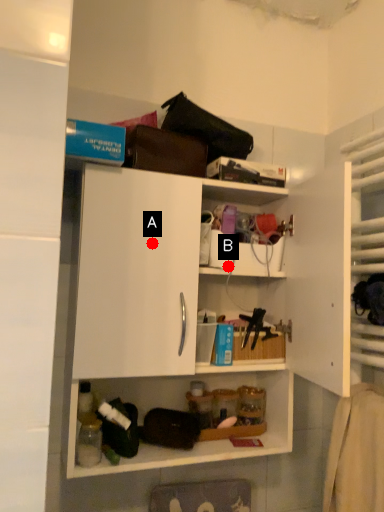
Question: Two points are circled on the image, labeled by A and B beside each circle. Among these points, which one is nearest to the camera?

Choices:
 (A) A is closer
 (B) B is closer

Answer: (A)